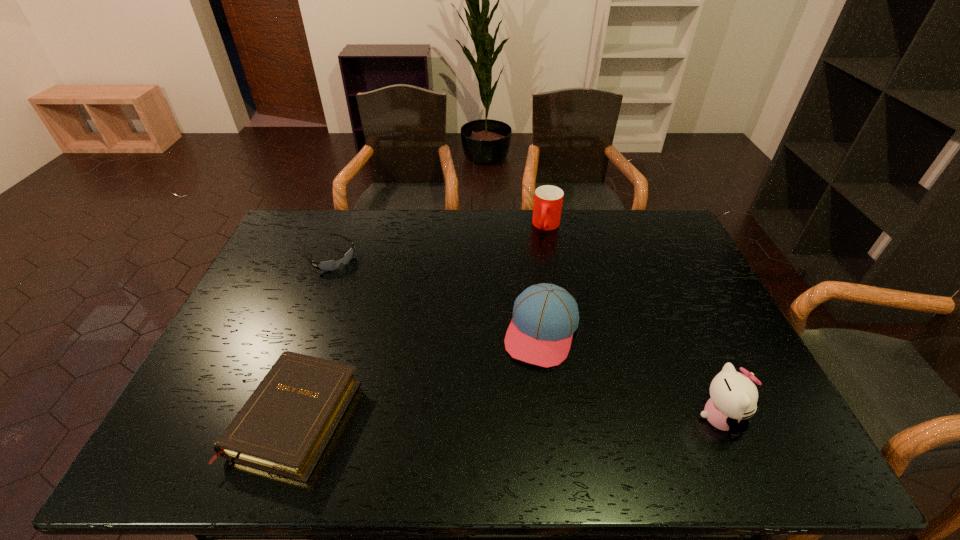
What are the coordinates of `vacant area that lies between the Bible and the baseball cap` in the screenshot? It's located at (419, 374).

Locate an element on the screen. empty location between the Bible and the cup is located at coordinates (421, 321).

Identify the location of free spot between the kitten and the second shortest object. The height and width of the screenshot is (540, 960). (508, 417).

I want to click on object that is the nearest to the cup, so click(545, 316).

Where is `the third closest object to the fourth tallest object`? the third closest object to the fourth tallest object is located at coordinates (548, 200).

The image size is (960, 540). I want to click on free location that satisfies the following two spatial constraints: 1. on the front side of the rightmost object; 2. on the front-facing side of the cup, so click(583, 418).

Where is `free spot that satisfies the following two spatial constraints: 1. on the front side of the baseball cap; 2. on the front-facing side of the kitten`? free spot that satisfies the following two spatial constraints: 1. on the front side of the baseball cap; 2. on the front-facing side of the kitten is located at coordinates (553, 418).

Where is `free point that satisfies the following two spatial constraints: 1. on the front side of the sunglasses; 2. on the front-facing side of the tallest object`? This screenshot has height=540, width=960. free point that satisfies the following two spatial constraints: 1. on the front side of the sunglasses; 2. on the front-facing side of the tallest object is located at coordinates (266, 418).

At what (x,y) coordinates should I click in order to perform the action: click on vacant space that satisfies the following two spatial constraints: 1. on the front side of the tallest object; 2. on the front-facing side of the sunglasses. Please return your answer as a coordinate pair (x, y). Image resolution: width=960 pixels, height=540 pixels. Looking at the image, I should click on (266, 418).